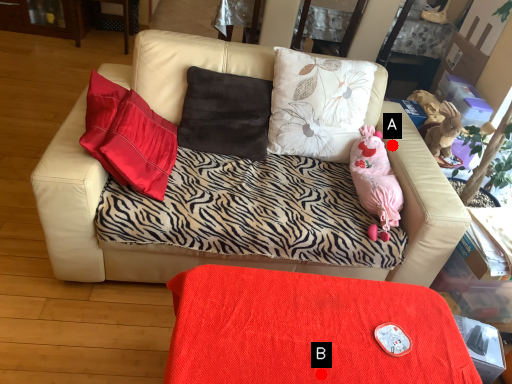
Question: Two points are circled on the image, labeled by A and B beside each circle. Which point is closer to the camera?

Choices:
 (A) A is closer
 (B) B is closer

Answer: (B)